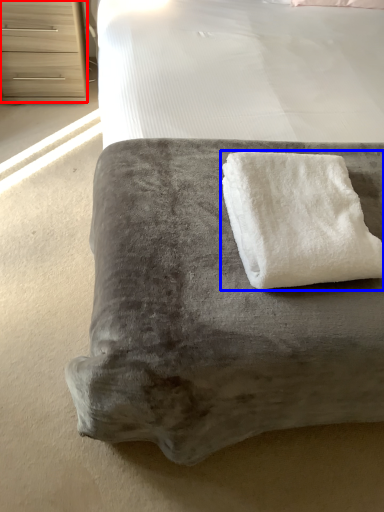
Question: Which object appears closest to the camera in this image, chest of drawers (highlighted by a red box) or towel (highlighted by a blue box)?

Choices:
 (A) chest of drawers
 (B) towel

Answer: (B)